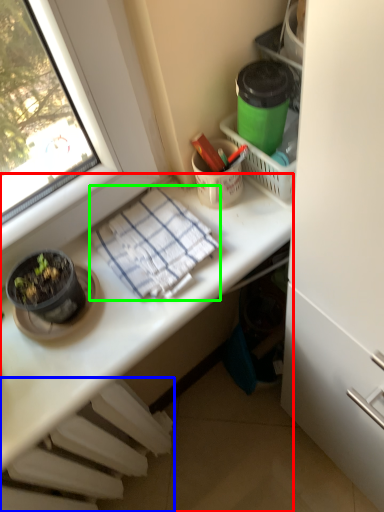
Question: Considering the real-world distances, which object is farthest from desk (highlighted by a red box)? radiator (highlighted by a blue box) or blanket (highlighted by a green box)?

Choices:
 (A) radiator
 (B) blanket

Answer: (A)